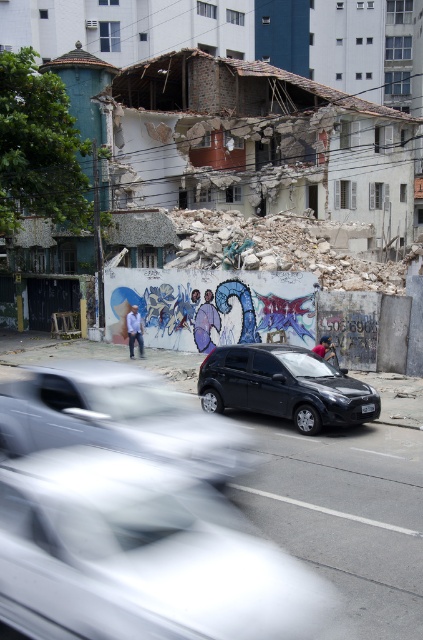
You are a delivery driver who needs to park your vehicle in this area. You see a metallic silver car at center and a black matte hatchback at center. Can you safely park your vehicle between them without hitting either?

The metallic silver car at center is positioned under the black matte hatchback at center, so there is no space between them for parking. You cannot safely park between them without hitting either vehicle.

You are standing at the point closer to the foreground in the urban scene. There are two points marked on the image, one at point [47,529] and another at point [282,394]. Which point are you standing on?

You are standing on point [47,529] because it is in front of point [282,394].

You are standing at the point marked by the coordinates point [140,557] in the image. What object is located exactly at that position?

The point [140,557] marks white glossy car at center.